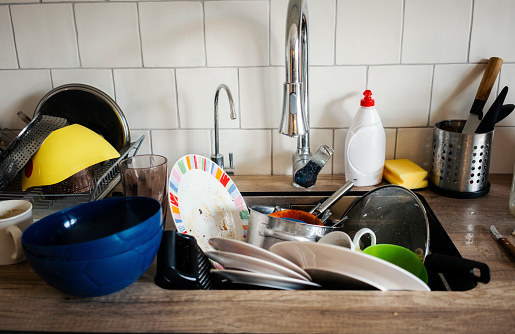
The image size is (515, 334). I want to click on plates, so click(216, 194), click(312, 254), click(262, 254), click(255, 258), click(250, 281).